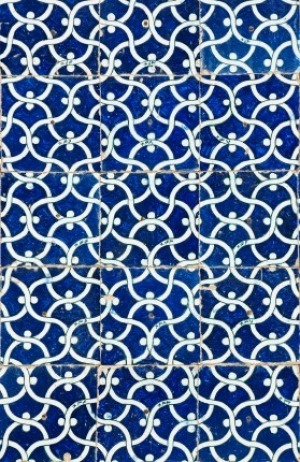
Locate an element on the screen. This screenshot has width=300, height=462. row 2 of tile is located at coordinates (157, 126).